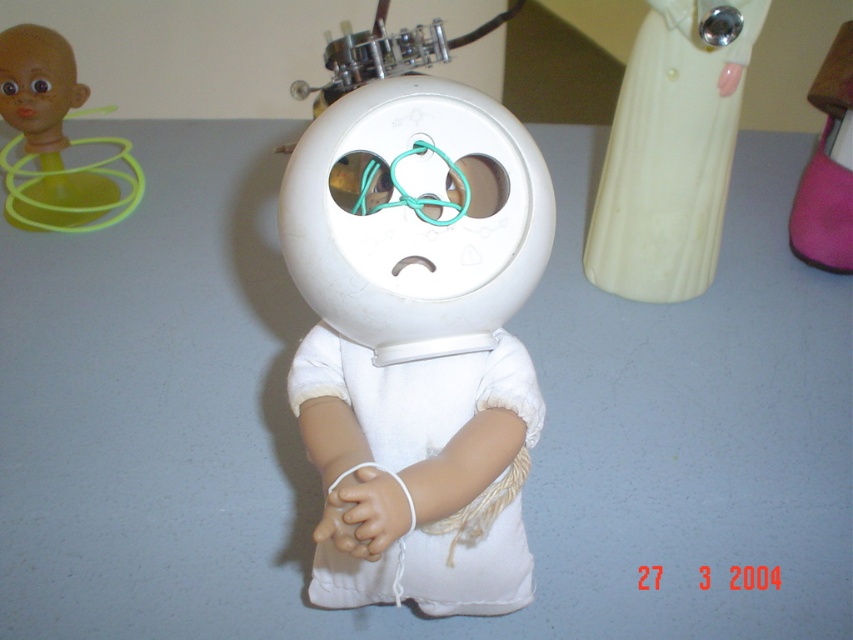
You are standing in front of the robot and notice a point marked at coordinates [668,157]. Which object does this point correspond to?

The point at coordinates [668,157] corresponds to the white glossy dress at upper right.

You are an interior designer planning to place the white matte robot at center and the matte yellow plastic toy at upper left on a shelf. Given their sizes, which object should you place first to ensure they both fit on the shelf?

The white matte robot at center is wider than the matte yellow plastic toy at upper left, so you should place the white matte robot at center first to ensure both fit on the shelf.

You are an interior designer arranging items on a shelf. You have the white glossy dress at upper right and the matte yellow plastic toy at upper left. Which object should you place on the left side of the shelf if you want the larger item to be on the right side?

The white glossy dress at upper right is bigger than the matte yellow plastic toy at upper left. To have the larger item on the right side of the shelf, place the matte yellow plastic toy at upper left on the left side and the white glossy dress at upper right on the right side.